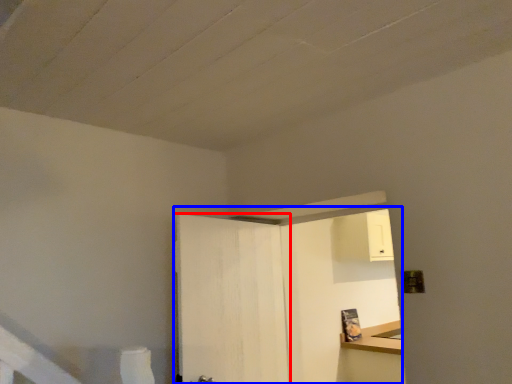
Question: Which point is closer to the camera, door (highlighted by a red box) or dresser (highlighted by a blue box)?

Choices:
 (A) door
 (B) dresser

Answer: (A)